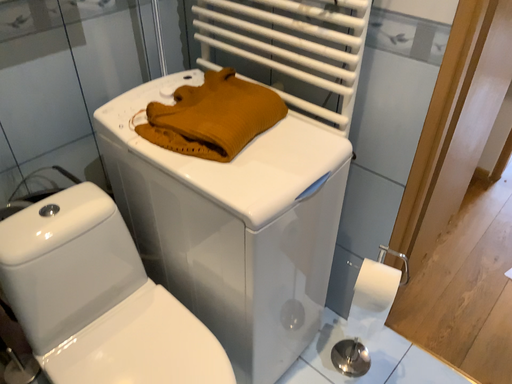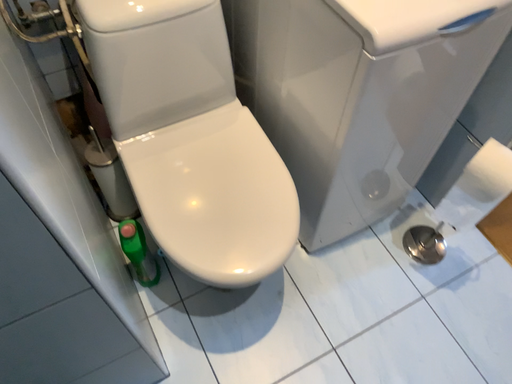
Question: How did the camera likely rotate when shooting the video?

Choices:
 (A) rotated upward
 (B) rotated downward

Answer: (B)